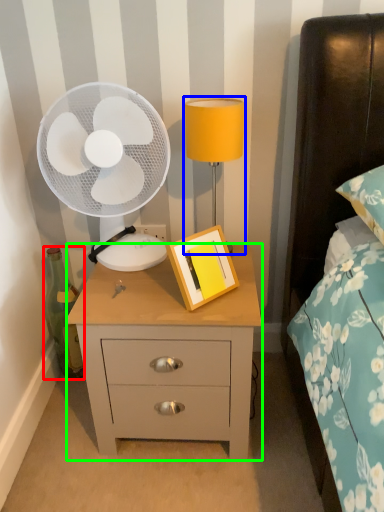
Question: Which object is positioned closest to bottle (highlighted by a red box)? Select from bedside lamp (highlighted by a blue box) and nightstand (highlighted by a green box).

Choices:
 (A) bedside lamp
 (B) nightstand

Answer: (B)